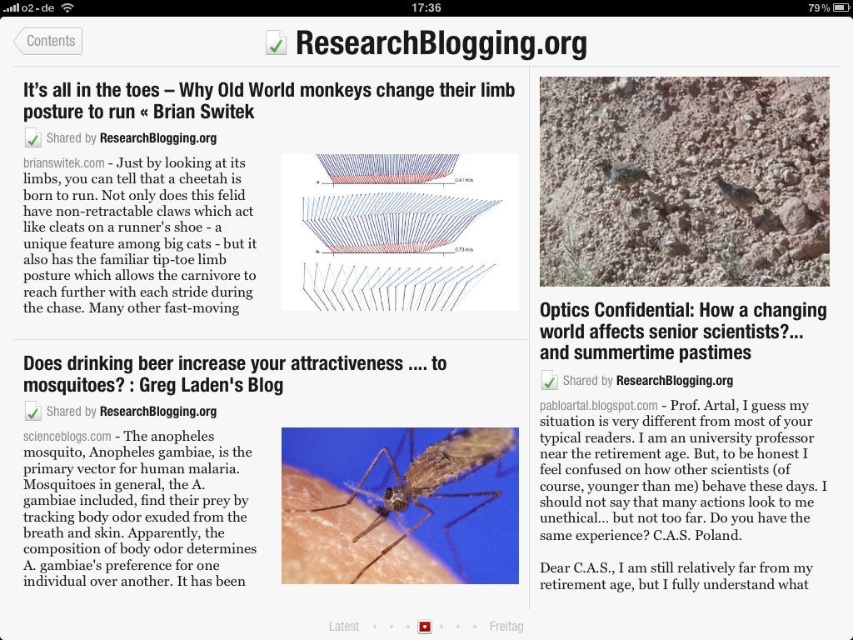
You are a researcher examining the image of the webpage on ResearchBlogging.org. You notice a translucent brown mosquito at center. If you want to click on it using your mouse cursor, which is currently at your screen center, would you need to move your cursor upwards or downwards?

The translucent brown mosquito at center is positioned at the center of the screen, so you do not need to move your cursor upwards or downwards to click on it.

You are a researcher examining the webpage and notice two mosquitoes. The translucent brown mosquito at center and the brown fuzzy mosquito at center. Which mosquito is positioned closer to you?

The translucent brown mosquito at center is closer to the viewer than the brown fuzzy mosquito at center.